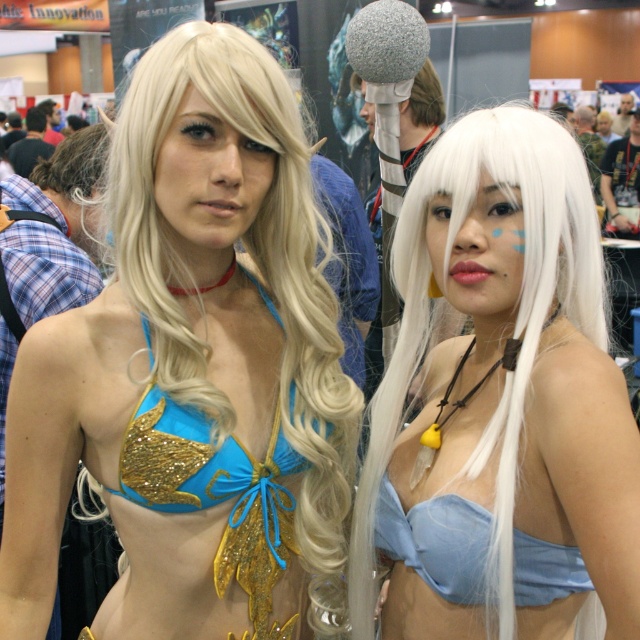
Question: Does glittery blue bikini top at center have a lesser width compared to light blue satin bikini top at center?

Choices:
 (A) no
 (B) yes

Answer: (A)

Question: Is matte blue bikini top at center to the left of glittery blue bikini top at center from the viewer's perspective?

Choices:
 (A) no
 (B) yes

Answer: (A)

Question: Among these points, which one is nearest to the camera?

Choices:
 (A) (365, 472)
 (B) (154, 435)

Answer: (B)

Question: Based on their relative distances, which object is farther from the glittery blue bikini top at center?

Choices:
 (A) matte blue bikini top at center
 (B) blue glitter bikini top at center

Answer: (A)

Question: Which of these objects is positioned farthest from the blue glitter bikini top at center?

Choices:
 (A) light blue satin bikini top at center
 (B) glittery blue bikini top at center

Answer: (A)

Question: Can you confirm if blue glitter bikini top at center is smaller than matte blue bikini top at center?

Choices:
 (A) no
 (B) yes

Answer: (A)